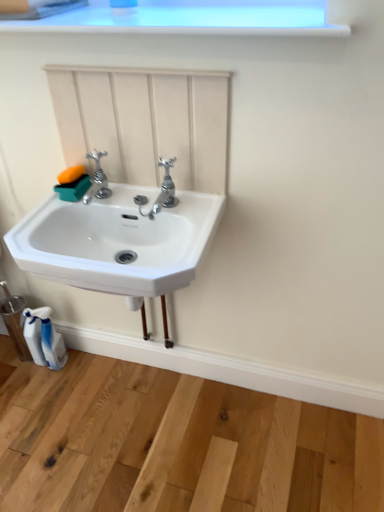
The image size is (384, 512). In order to click on free space to the left of white plastic spray bottle at lower left in this screenshot , I will do `click(18, 374)`.